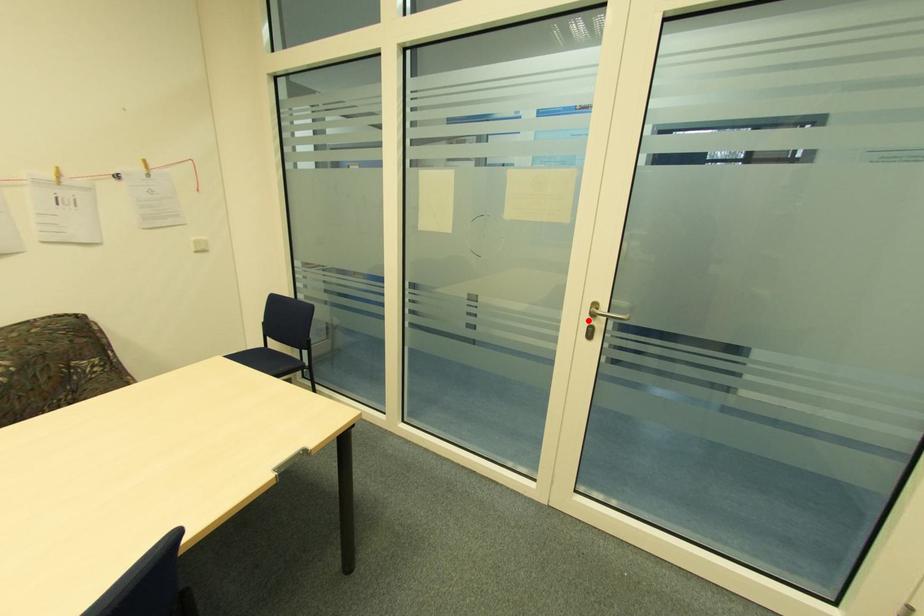
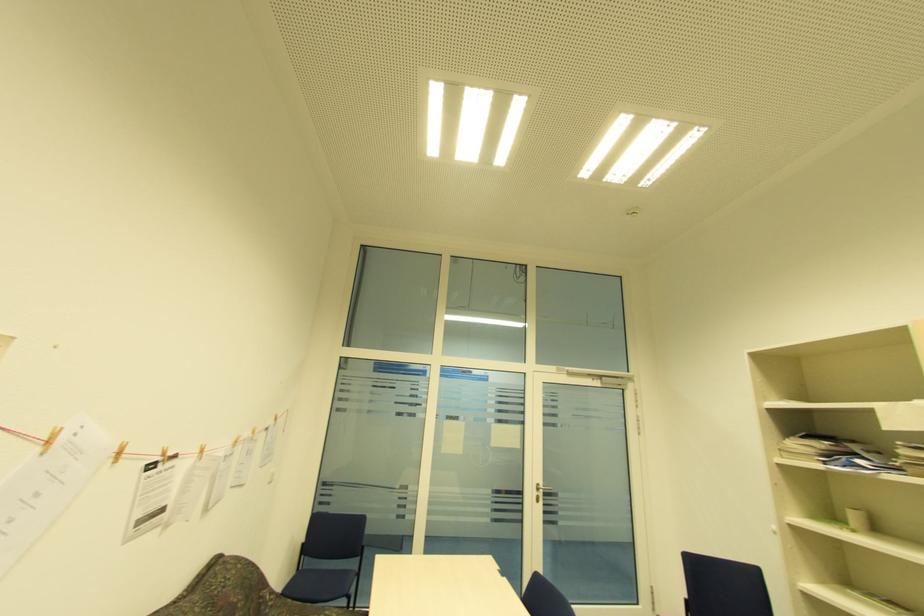
Question: I am providing you with two images of the same scene from different viewpoints. Image1 has a red point marked. In image2, the corresponding 3D location appears at what relative position? Reply with the corresponding letter.

Choices:
 (A) Closer
 (B) Farther

Answer: (B)